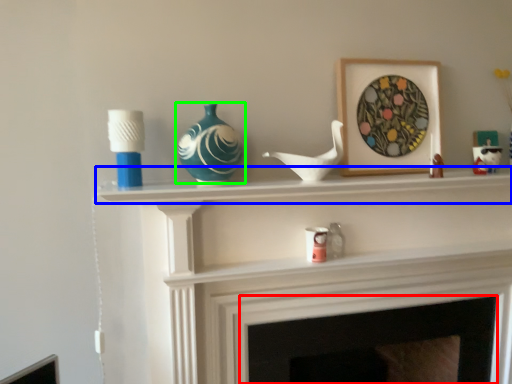
Question: Which object is the closest to the fireplace (highlighted by a red box)? Choose among these: mantle (highlighted by a blue box) or vase (highlighted by a green box).

Choices:
 (A) mantle
 (B) vase

Answer: (A)